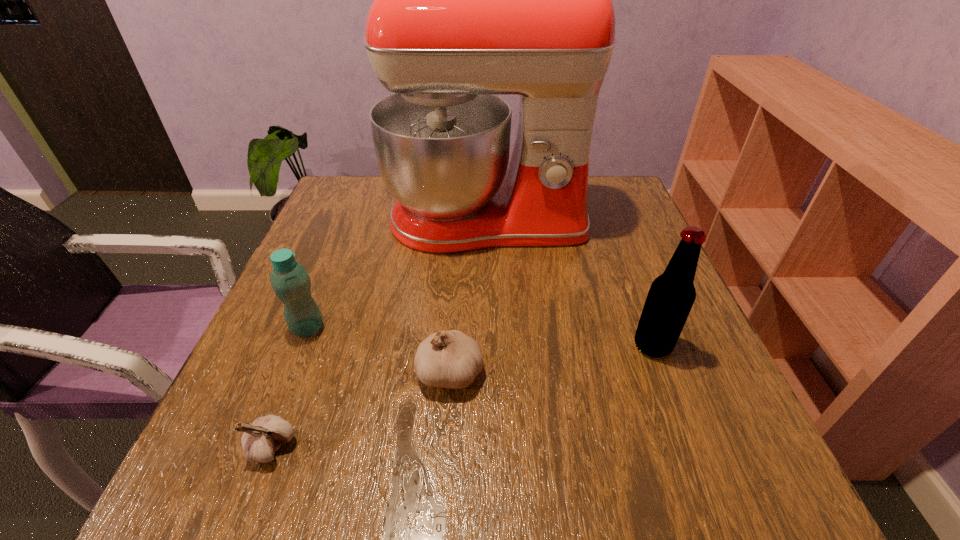
This screenshot has width=960, height=540. I want to click on mixer, so click(x=471, y=0).

Identify the location of the tallest object. (471, 0).

Locate an element on the screen. The height and width of the screenshot is (540, 960). the fourth shortest object is located at coordinates (671, 296).

Locate an element on the screen. beer bottle is located at coordinates (671, 296).

The height and width of the screenshot is (540, 960). In order to click on the third tallest object in this screenshot , I will do `click(290, 281)`.

Locate an element on the screen. The height and width of the screenshot is (540, 960). the right garlic is located at coordinates (450, 359).

What are the coordinates of `the fourth tallest object` in the screenshot? It's located at (450, 359).

Find the location of a particular element. the nearest object is located at coordinates (260, 440).

Identify the location of the shortest object. The width and height of the screenshot is (960, 540). (260, 440).

Locate an element on the screen. This screenshot has height=540, width=960. vacant position located on the front-facing side of the tallest object is located at coordinates (490, 345).